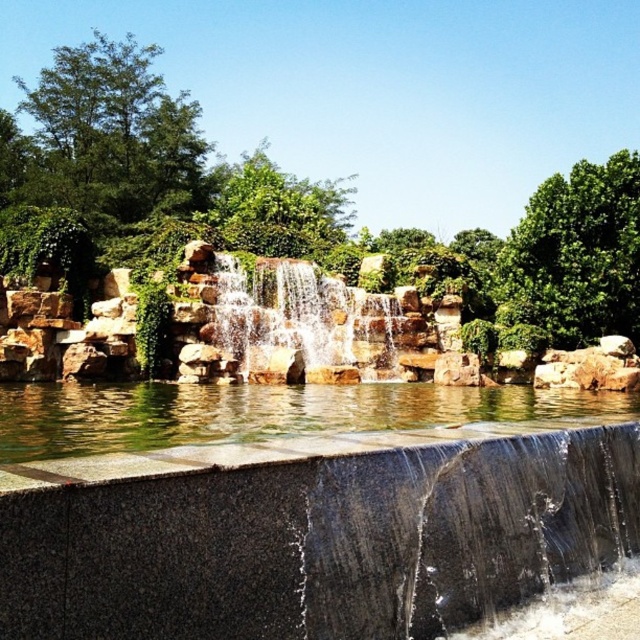
You are designing a garden and want to place a small statue between the clear water at center and the smooth stone waterfall at center. Based on their widths, which object should the statue be closer to?

The clear water at center is wider than the smooth stone waterfall at center, so the statue should be placed closer to the clear water at center to balance the design.

You are standing in front of the waterfall scene and want to place a small decorative rock between the clear water at center and the smooth stone waterfall at center. According to their positions, which object should the decorative rock be placed to the right of?

The clear water at center is positioned on the right side of smooth stone waterfall at center, so the decorative rock should be placed to the right of the smooth stone waterfall at center.

You are standing at the edge of the scene and want to throw a stone into the clear water at center. Considering the distance, do you think you can reach it with an average throw?

The clear water at center is 46.78 meters away from the viewer. An average human throw can reach up to around 20 meters, so it is unlikely you can reach the clear water at center with a stone throw.